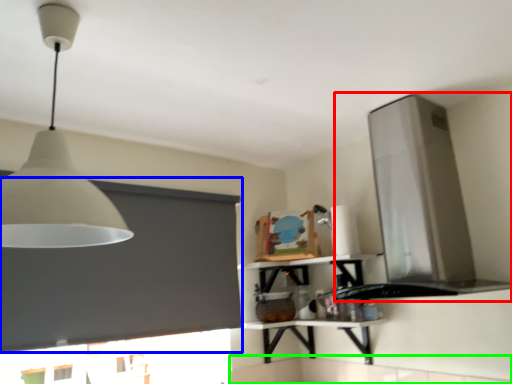
Question: Which object is positioned farthest from vent (highlighted by a red box)? Select from window screen (highlighted by a blue box) and counter top (highlighted by a green box).

Choices:
 (A) window screen
 (B) counter top

Answer: (A)